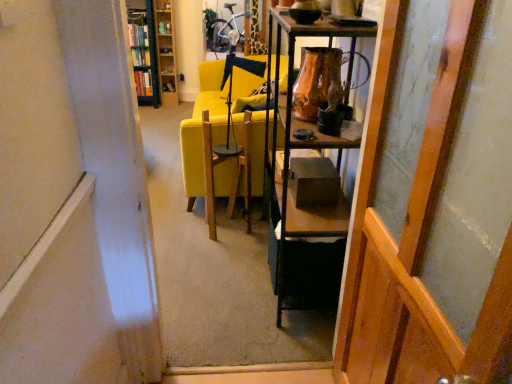
What are the coordinates of `free space to the left of wooden chair at center` in the screenshot? It's located at (189, 225).